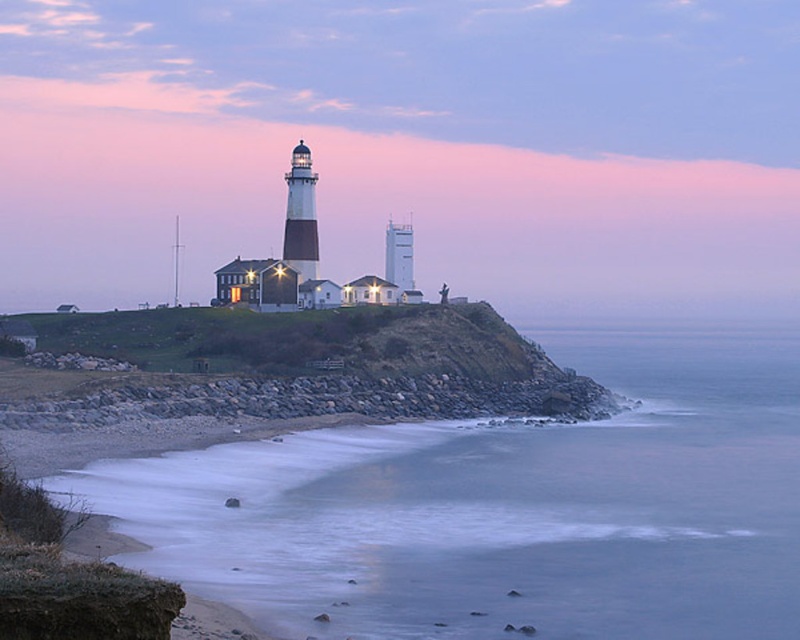
Who is positioned more to the left, white matte lighthouse at center or gray rock wall at lower center?

Positioned to the left is gray rock wall at lower center.

Which is more to the right, white matte lighthouse at center or gray rock wall at lower center?

white matte lighthouse at center

Is point (200, 262) farther from camera compared to point (534, 378)?

Yes, point (200, 262) is behind point (534, 378).

This screenshot has height=640, width=800. I want to click on white matte lighthouse at center, so click(x=408, y=147).

Does blue smooth water at lower left appear on the right side of gray rock wall at lower center?

Correct, you'll find blue smooth water at lower left to the right of gray rock wall at lower center.

Can you confirm if blue smooth water at lower left is wider than gray rock wall at lower center?

Yes.

Is point (713, 416) farther from camera compared to point (356, 403)?

Yes, it is.

Image resolution: width=800 pixels, height=640 pixels. Identify the location of blue smooth water at lower left. (508, 508).

Who is positioned more to the left, white matte lighthouse at center or blue smooth water at lower left?

blue smooth water at lower left

Can you confirm if white matte lighthouse at center is thinner than blue smooth water at lower left?

No.

Is point (354, 60) farther from camera compared to point (546, 452)?

Yes, point (354, 60) is behind point (546, 452).

This screenshot has width=800, height=640. Identify the location of white matte lighthouse at center. (408, 147).